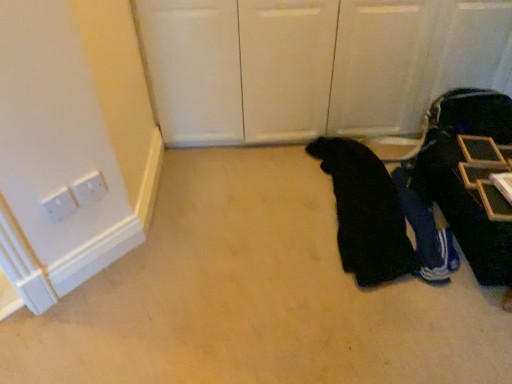
Question: In terms of size, does dark blue fabric suitcase at right appear bigger or smaller than black fabric at lower right, acting as the first person starting from the left?

Choices:
 (A) small
 (B) big

Answer: (B)

Question: In terms of width, does dark blue fabric suitcase at right look wider or thinner when compared to black fabric at lower right, acting as the first person starting from the left?

Choices:
 (A) thin
 (B) wide

Answer: (A)

Question: Considering the real-world distances, which object is closest to the black fabric at lower right, positioned as the second person in right-to-left order?

Choices:
 (A) blue fabric pants at lower right, acting as the first person starting from the right
 (B) dark blue fabric suitcase at right

Answer: (A)

Question: Which object is the closest to the blue fabric pants at lower right, marked as the 2th person in a left-to-right arrangement?

Choices:
 (A) black fabric at lower right, acting as the first person starting from the left
 (B) dark blue fabric suitcase at right

Answer: (A)